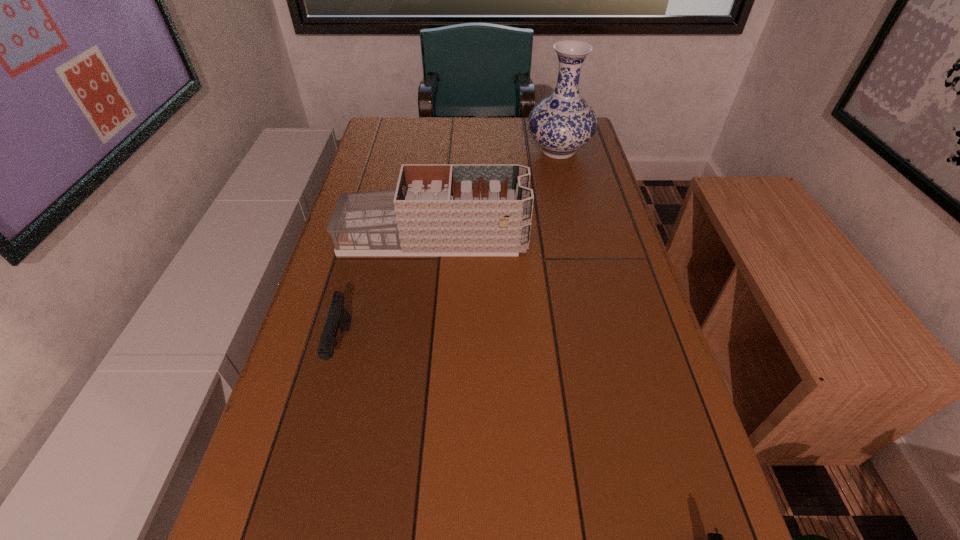
Find the location of a particular element. The width and height of the screenshot is (960, 540). the farthest object is located at coordinates (563, 122).

This screenshot has width=960, height=540. I want to click on vase, so click(563, 122).

At what (x,y) coordinates should I click in order to perform the action: click on the third shortest object. Please return your answer as a coordinate pair (x, y). This screenshot has width=960, height=540. Looking at the image, I should click on (437, 209).

What are the coordinates of `the third nearest object` in the screenshot? It's located at (437, 209).

At what (x,y) coordinates should I click in order to perform the action: click on the left pistol. Please return your answer as a coordinate pair (x, y). Looking at the image, I should click on 338,316.

At what (x,y) coordinates should I click in order to perform the action: click on the farther pistol. Please return your answer as a coordinate pair (x, y). Looking at the image, I should click on (338, 316).

At what (x,y) coordinates should I click in order to perform the action: click on free space located on the front of the vase. Please return your answer as a coordinate pair (x, y). The height and width of the screenshot is (540, 960). Looking at the image, I should click on (575, 221).

Where is `blank area located at the entrance of the dollhouse`? This screenshot has height=540, width=960. blank area located at the entrance of the dollhouse is located at coordinates (623, 238).

Locate an element on the screen. The height and width of the screenshot is (540, 960). vacant area situated 0.070m at the barrel of the third tallest object is located at coordinates (324, 411).

Image resolution: width=960 pixels, height=540 pixels. I want to click on object present at the far edge, so pos(563,122).